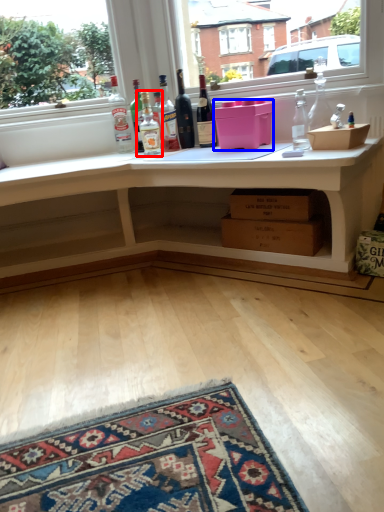
Question: Which point is closer to the camera, bottle (highlighted by a red box) or box (highlighted by a blue box)?

Choices:
 (A) bottle
 (B) box

Answer: (B)